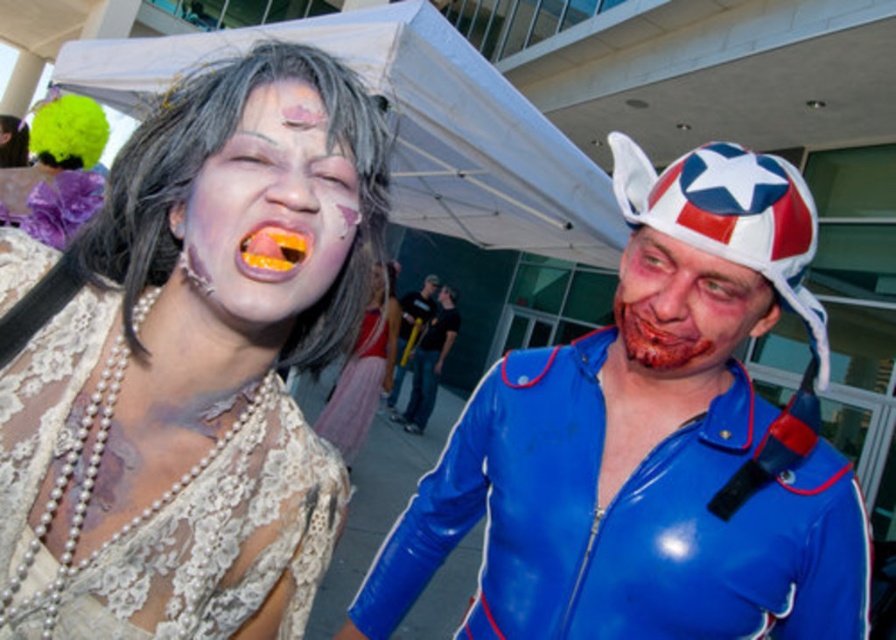
You are standing at the point marked as point (678, 390) in the image. You want to take a photo of the zombie costume on the left. Can you reach the camera to take the photo?

The point marked as point (678, 390) and the camera are 1.01 meters apart. Since the distance is just over 1 meter, you can reach the camera to take the photo.

You are a photographer at a costume party and need to capture both the blue glossy jacket at center and the matte blue helmet at right in a single frame. Which object should you position closer to the camera to ensure both fit in the frame without cropping?

Since the blue glossy jacket at center is wider than the matte blue helmet at right, you should position the matte blue helmet at right closer to the camera to compensate for its smaller width and ensure both fit within the frame.